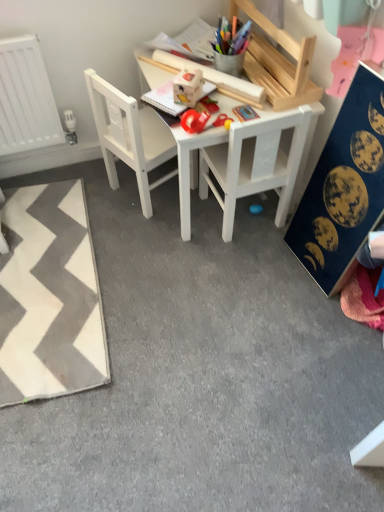
You are a GUI agent. You are given a task and a screenshot of the screen. Output one action in this format:
    pyautogui.click(x=<x>, y=<y>)
    Task: Click on the blank area to the left of white matte chair at center, the second chair from the right
    This screenshot has height=512, width=384.
    Given the screenshot: What is the action you would take?
    pyautogui.click(x=99, y=190)